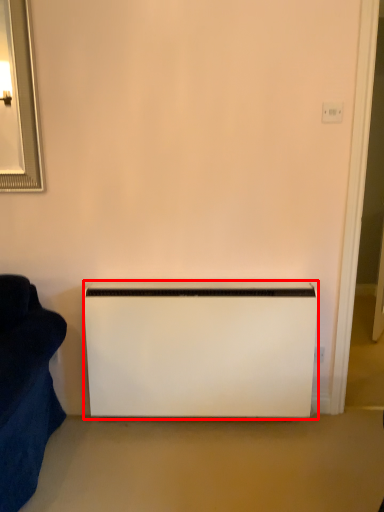
Question: In this image, where is appliance (annotated by the red box) located relative to electric outlet?

Choices:
 (A) right
 (B) left

Answer: (B)